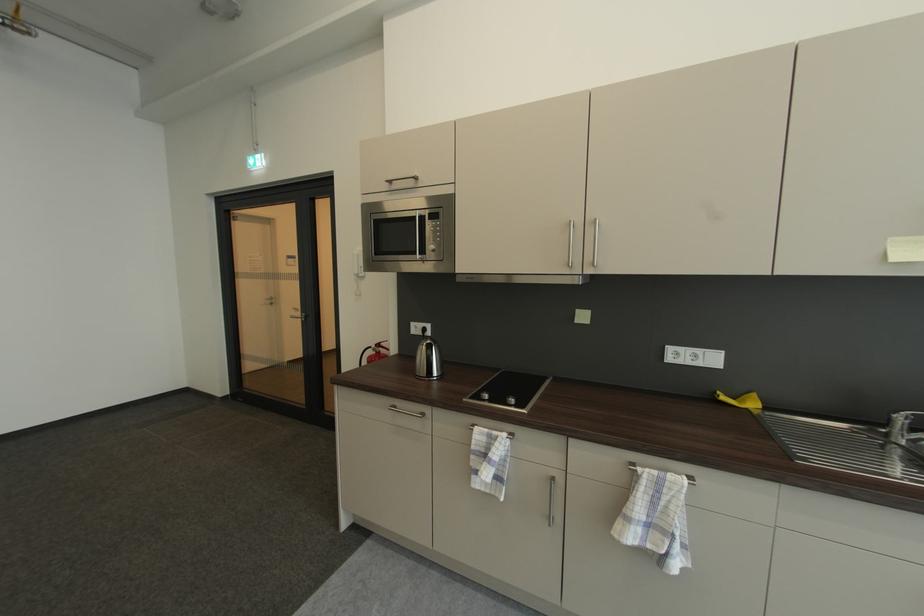
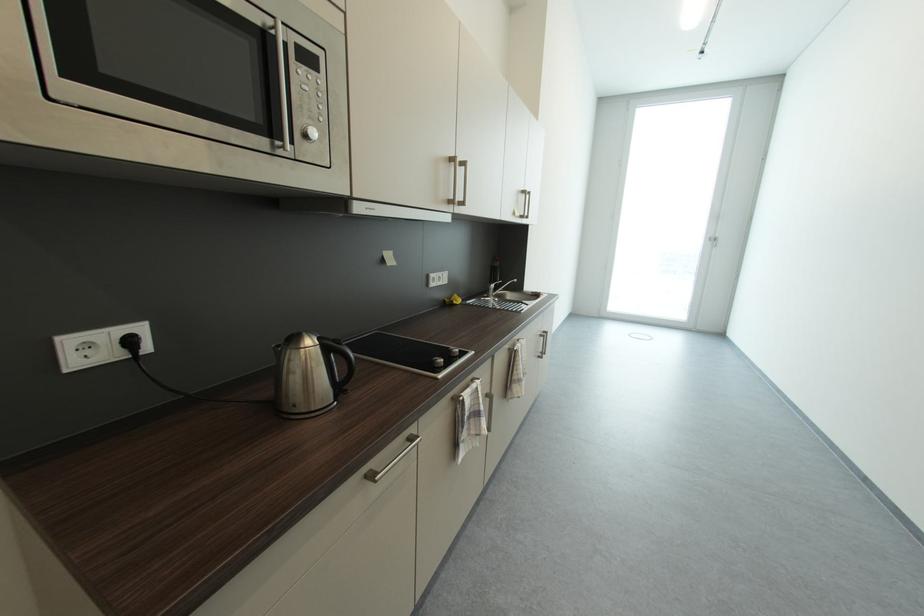
Find the pixel in the second image that matches point 439,230 in the first image.

(313, 89)